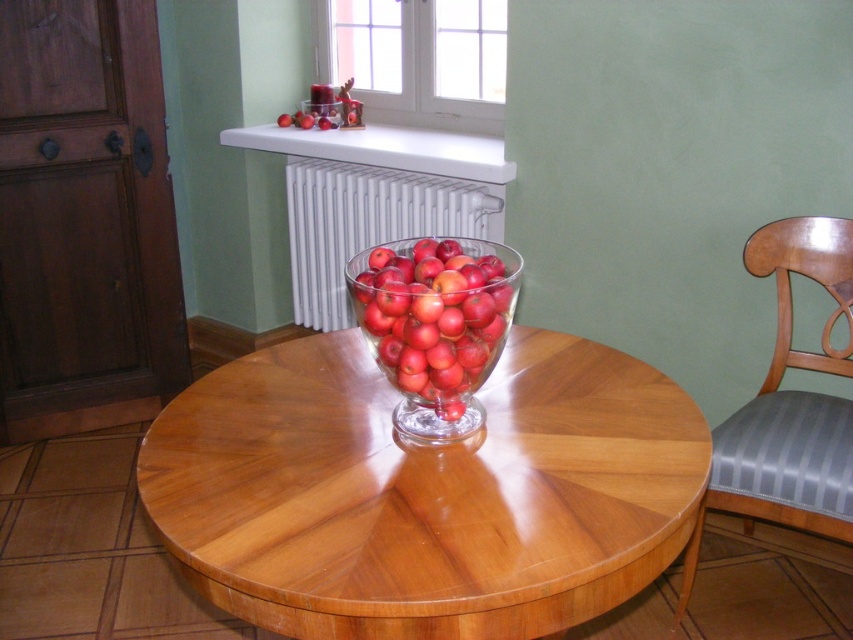
Question: Observing the image, what is the correct spatial positioning of wooden table at center in reference to white metallic radiator at upper center?

Choices:
 (A) below
 (B) above

Answer: (A)

Question: Which object appears closest to the camera in this image?

Choices:
 (A) transparent glass bowl at center
 (B) wooden table at center

Answer: (B)

Question: Which object is farther from the camera taking this photo?

Choices:
 (A) wooden table at center
 (B) wooden chair with striped cushion at right
 (C) transparent glass bowl at center

Answer: (B)

Question: Which of the following is the closest to the observer?

Choices:
 (A) (328, 266)
 (B) (790, 524)
 (C) (589, 396)

Answer: (C)

Question: Is wooden chair with striped cushion at right bigger than white metallic radiator at upper center?

Choices:
 (A) yes
 (B) no

Answer: (B)

Question: Is wooden table at center in front of white metallic radiator at upper center?

Choices:
 (A) no
 (B) yes

Answer: (B)